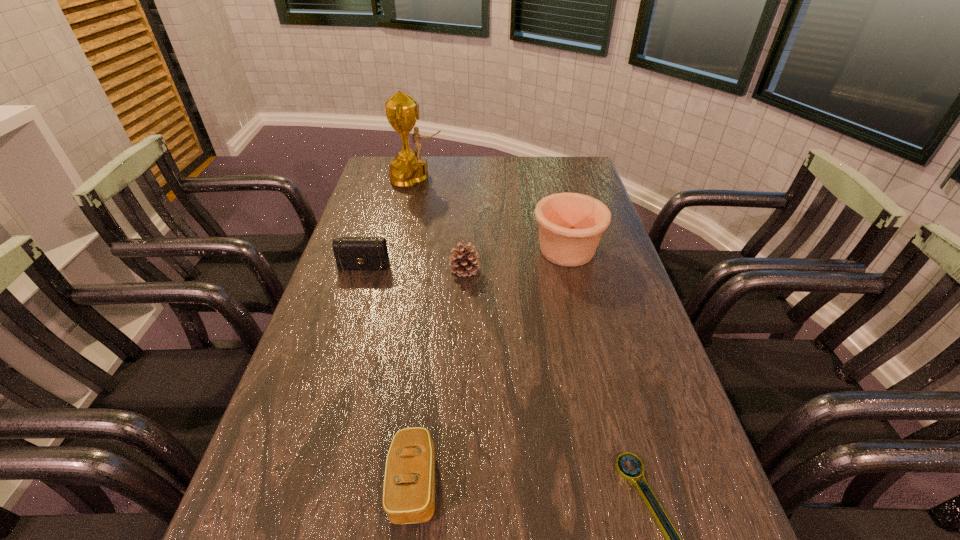
In the image, there is a desktop. Where is `blank space at the right edge`? This screenshot has height=540, width=960. blank space at the right edge is located at coordinates (588, 302).

Identify the location of free space between the second tallest object and the pinecone. (516, 261).

Find the location of a particular element. vacant area that lies between the fifth tallest object and the pottery is located at coordinates (491, 367).

Locate an element on the screen. vacant area between the taller clutch bag and the right clutch bag is located at coordinates (389, 376).

Image resolution: width=960 pixels, height=540 pixels. What are the coordinates of `free area in between the shorter clutch bag and the pottery` in the screenshot? It's located at (491, 367).

The width and height of the screenshot is (960, 540). Identify the location of free space between the left clutch bag and the tallest object. (390, 223).

I want to click on free point between the shorter clutch bag and the left clutch bag, so click(x=389, y=376).

Find the location of `empty space that is in between the shorter clutch bag and the fifth shortest object`. empty space that is in between the shorter clutch bag and the fifth shortest object is located at coordinates (491, 367).

Find the location of `empty location between the second tallest object and the pinecone`. empty location between the second tallest object and the pinecone is located at coordinates (516, 261).

Find the location of a particular element. Image resolution: width=960 pixels, height=540 pixels. object that can be found as the fourth closest to the farthest object is located at coordinates (409, 484).